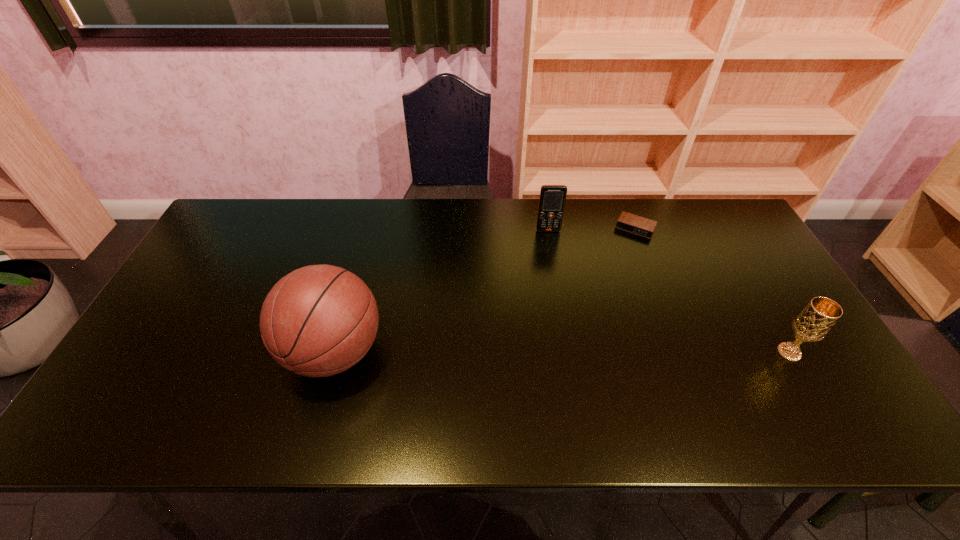
Where is `vacant region at the left edge of the desktop`? The image size is (960, 540). vacant region at the left edge of the desktop is located at coordinates (236, 259).

Where is `vacant space at the right edge of the desktop`? The image size is (960, 540). vacant space at the right edge of the desktop is located at coordinates (768, 334).

Locate an element on the screen. The height and width of the screenshot is (540, 960). free space at the far left corner is located at coordinates (247, 231).

I want to click on vacant space at the near left corner of the desktop, so click(x=153, y=392).

In the image, there is a desktop. At what (x,y) coordinates should I click in order to perform the action: click on vacant space at the near right corner. Please return your answer as a coordinate pair (x, y). Looking at the image, I should click on pos(804,371).

Identify the location of vacant area that lies between the shortest object and the tallest object. The height and width of the screenshot is (540, 960). (485, 291).

At what (x,y) coordinates should I click in order to perform the action: click on vacant space that's between the basketball and the alarm clock. Please return your answer as a coordinate pair (x, y). Looking at the image, I should click on (485, 291).

Locate an element on the screen. This screenshot has height=540, width=960. free space between the tallest object and the cellular telephone is located at coordinates (442, 292).

Find the location of a particular element. This screenshot has width=960, height=540. free space between the basketball and the chalice is located at coordinates (562, 352).

Where is `free space between the alarm clock and the cellular telephone`? free space between the alarm clock and the cellular telephone is located at coordinates (591, 230).